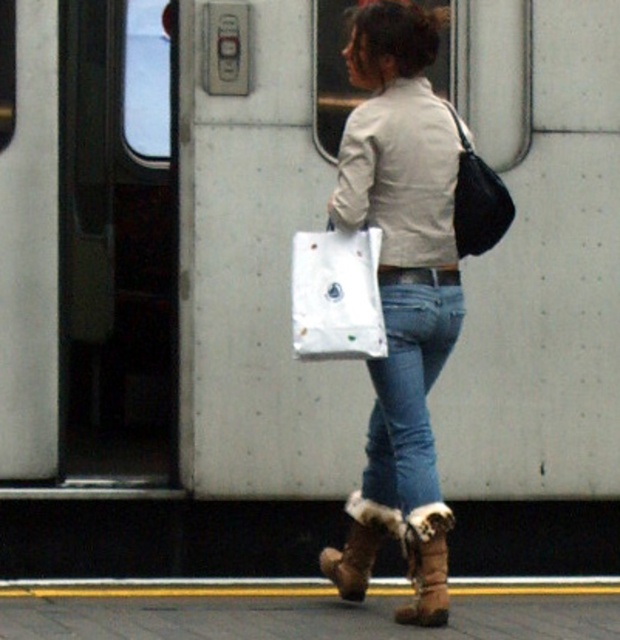
Is point (298, 244) in front of point (445, 611)?

No.

The width and height of the screenshot is (620, 640). I want to click on white paper bag at center, so click(x=337, y=294).

Image resolution: width=620 pixels, height=640 pixels. Identify the location of white paper bag at center. (337, 294).

Locate an element on the screen. white paper bag at center is located at coordinates tap(337, 294).

Is point (396, 317) more distant than point (422, 275)?

That is False.

Which is below, denim jeans at center or jeans at center?

jeans at center is below.

Is point (372, 115) more distant than point (392, 448)?

No, (372, 115) is closer to viewer.

Locate an element on the screen. The image size is (620, 640). denim jeans at center is located at coordinates (401, 292).

Does denim jeans at center have a greater height compared to brown suede boot at lower center?

Yes, denim jeans at center is taller than brown suede boot at lower center.

Does denim jeans at center have a smaller size compared to brown suede boot at lower center?

Actually, denim jeans at center might be larger than brown suede boot at lower center.

Who is more distant from viewer, (448,221) or (445,557)?

The point (448,221) is more distant.

The width and height of the screenshot is (620, 640). I want to click on denim jeans at center, so click(401, 292).